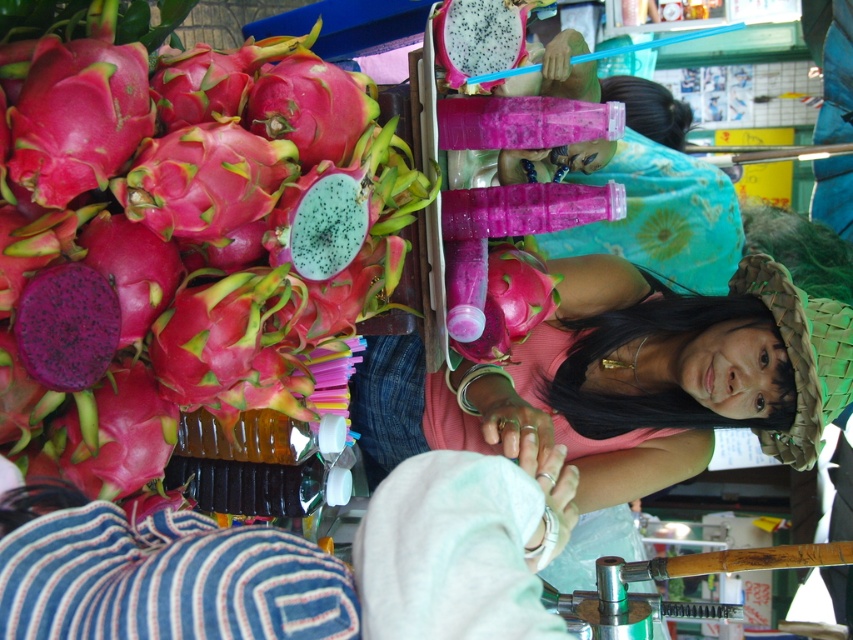
You are a customer at the market and want to grab both the pink matte dragonfruit at upper left and the pink matte dragon fruit at center. Can you reach both items if your arms can extend 14 inches in total?

The pink matte dragonfruit at upper left and pink matte dragon fruit at center are 13.73 inches apart, so yes, you can reach both items since your arms can extend 14 inches which is slightly longer than the distance between them.

In the scene shown: You are standing in the market and see the dragon fruits arranged in a pile. There is a specific point marked at coordinates [186,246]. Which dragon fruit is located at this point?

The point at coordinates [186,246] corresponds to the pink matte dragonfruit at upper left.